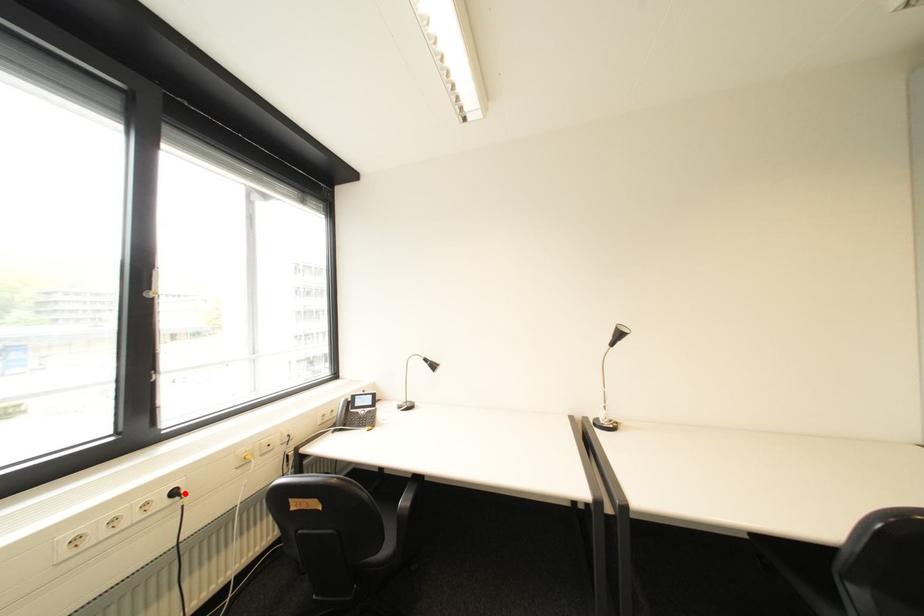
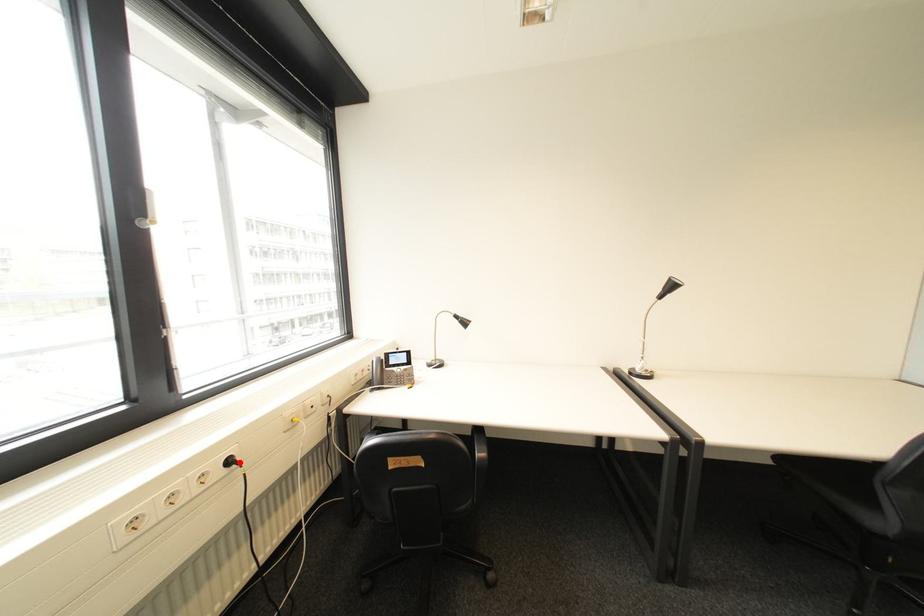
I am providing you with two images of the same scene from different viewpoints. A red point is marked on the first image and another point is marked on the second image. Is the marked point in image1 the same physical position as the marked point in image2?

Yes